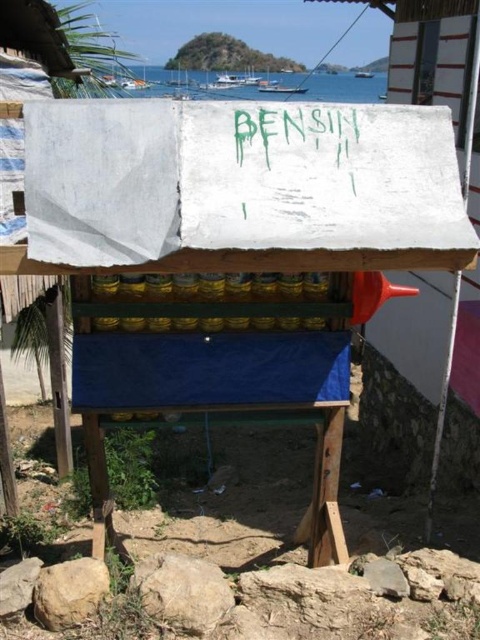
Does point (324, 113) come farther from viewer compared to point (350, 83)?

That is False.

Which of these two, green painted sign at center or blue water at upper center, stands shorter?

With less height is green painted sign at center.

At what (x,y) coordinates should I click in order to perform the action: click on green painted sign at center. Please return your answer as a coordinate pair (x, y). Looking at the image, I should click on (298, 138).